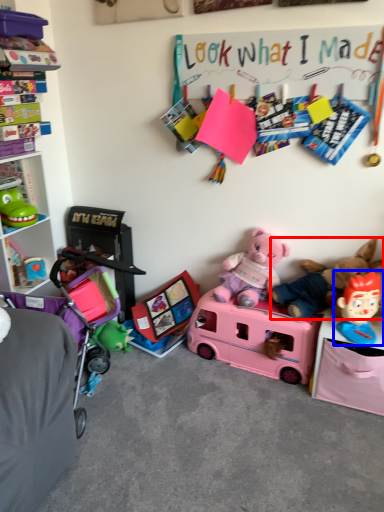
Question: Which object appears closest to the camera in this image, teddy bear (highlighted by a red box) or toy (highlighted by a blue box)?

Choices:
 (A) teddy bear
 (B) toy

Answer: (B)